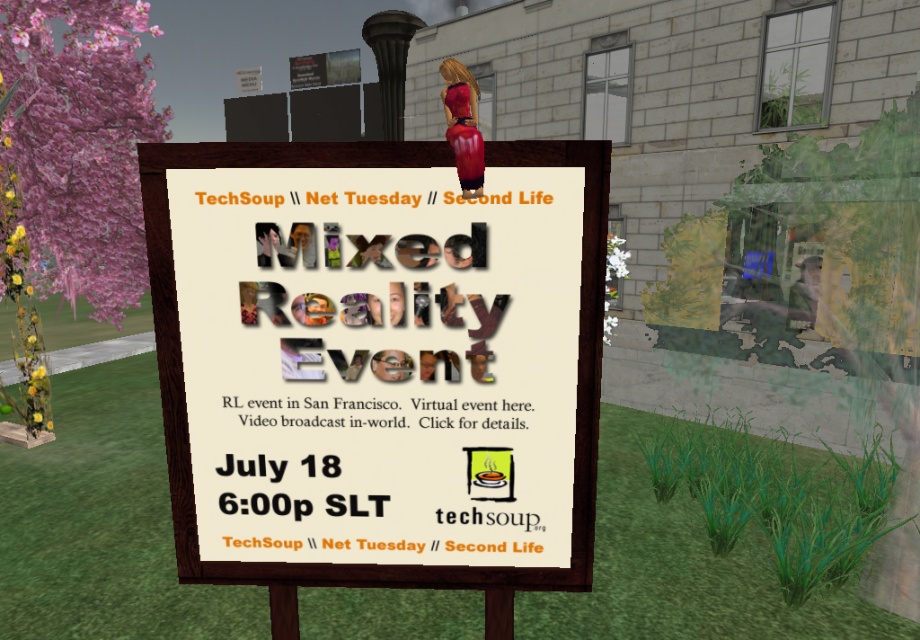
You are a virtual gardener in Second Life who wants to plant a new row of flowers between the green grass at center and the pink floral tree at left. Based on their widths, which object should you place the flowers closer to?

The green grass at center is wider than the pink floral tree at left, so you should place the flowers closer to the pink floral tree at left to ensure they fit within the available space.

You are navigating a virtual environment and need to locate the matte paper sign at center. According to the scene description, where should you look to find it?

The matte paper sign at center is located at point (378, 360), so you should look towards the center of the scene to find it.